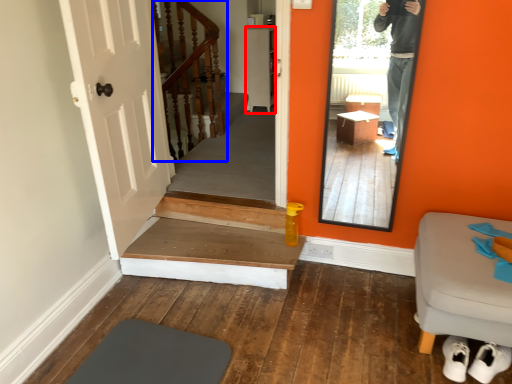
Question: Which point is closer to the camera, cabinetry (highlighted by a red box) or stairs (highlighted by a blue box)?

Choices:
 (A) cabinetry
 (B) stairs

Answer: (B)